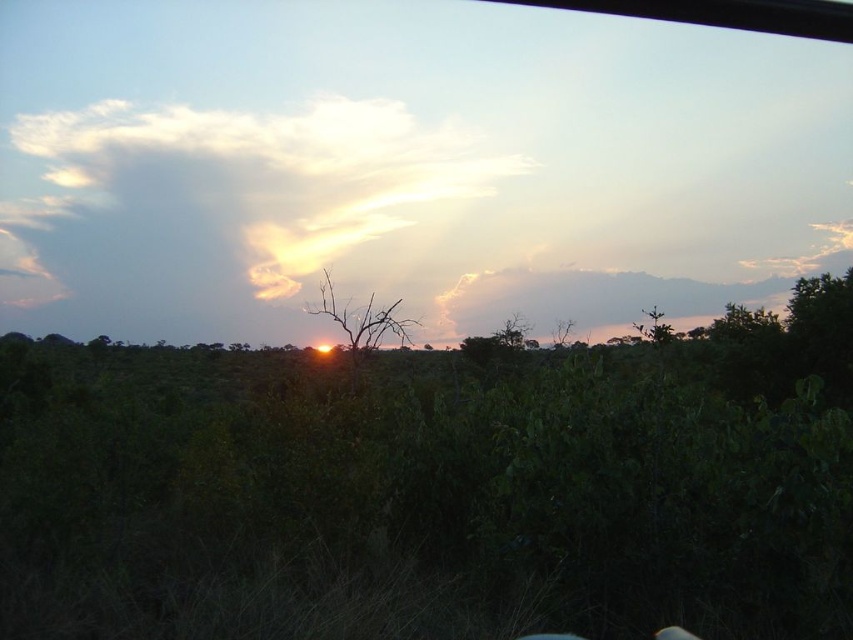
In the scene shown: How much distance is there between cloudy sky at upper center and brown textured tree at center?

The distance of cloudy sky at upper center from brown textured tree at center is 13.67 meters.

Who is more distant from viewer, (x=518, y=172) or (x=509, y=332)?

Point (x=518, y=172)

Is point (137, 292) positioned before point (514, 321)?

No, (137, 292) is further to viewer.

The height and width of the screenshot is (640, 853). What are the coordinates of `cloudy sky at upper center` in the screenshot? It's located at (231, 196).

Does point (33, 209) come farther from viewer compared to point (321, 296)?

Yes.

Between cloudy sky at upper center and brown dry at center, which one appears on the right side from the viewer's perspective?

brown dry at center is more to the right.

Measure the distance between cloudy sky at upper center and camera.

The distance of cloudy sky at upper center from camera is 38.13 meters.

Locate an element on the screen. This screenshot has width=853, height=640. cloudy sky at upper center is located at coordinates (231, 196).

Between brown dry at center and brown textured tree at center, which one appears on the right side from the viewer's perspective?

Positioned to the right is brown textured tree at center.

Is brown dry at center to the left of brown textured tree at center from the viewer's perspective?

Correct, you'll find brown dry at center to the left of brown textured tree at center.

What do you see at coordinates (363, 320) in the screenshot? I see `brown dry at center` at bounding box center [363, 320].

Where is `brown dry at center`? This screenshot has width=853, height=640. brown dry at center is located at coordinates (363, 320).